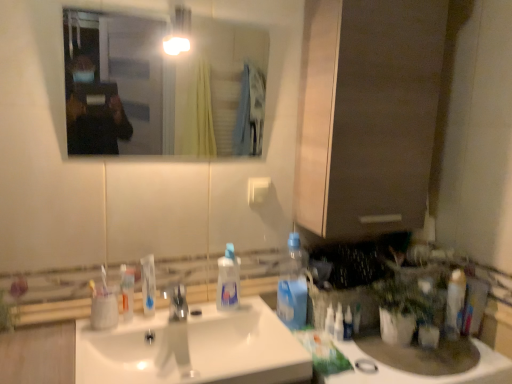
Where is `blank space to the left of white plastic toothpaste tube at lower right, which appears as the first toiletry when viewed from the left`? This screenshot has height=384, width=512. blank space to the left of white plastic toothpaste tube at lower right, which appears as the first toiletry when viewed from the left is located at coordinates (310, 335).